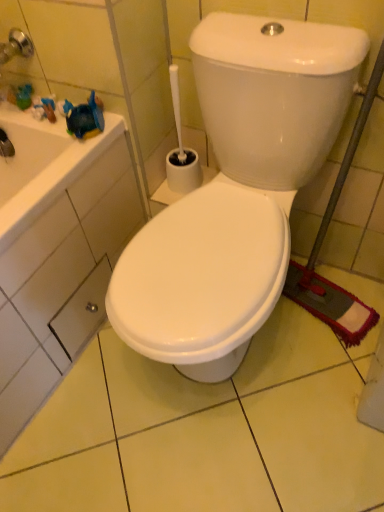
Question: In terms of height, does metallic silver drawer at lower left look taller or shorter compared to white glossy toilet at center?

Choices:
 (A) tall
 (B) short

Answer: (B)

Question: Do you think metallic silver drawer at lower left is within white glossy toilet at center, or outside of it?

Choices:
 (A) outside
 (B) inside

Answer: (A)

Question: Visually, is metallic silver drawer at lower left positioned to the left or to the right of white glossy toilet at center?

Choices:
 (A) right
 (B) left

Answer: (B)

Question: Choose the correct answer: Is white glossy toilet at center inside metallic silver drawer at lower left or outside it?

Choices:
 (A) outside
 (B) inside

Answer: (A)

Question: From a real-world perspective, is white glossy toilet at center positioned above or below metallic silver drawer at lower left?

Choices:
 (A) above
 (B) below

Answer: (A)

Question: Considering the positions of point (142, 347) and point (61, 329), is point (142, 347) closer or farther from the camera than point (61, 329)?

Choices:
 (A) farther
 (B) closer

Answer: (B)

Question: Is white glossy toilet at center wider or thinner than metallic silver drawer at lower left?

Choices:
 (A) wide
 (B) thin

Answer: (A)